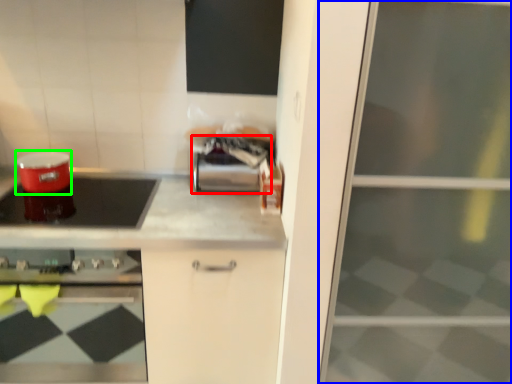
Question: Which object is the closest to the appliance (highlighted by a red box)? Choose among these: screen door (highlighted by a blue box) or appliance (highlighted by a green box).

Choices:
 (A) screen door
 (B) appliance

Answer: (B)